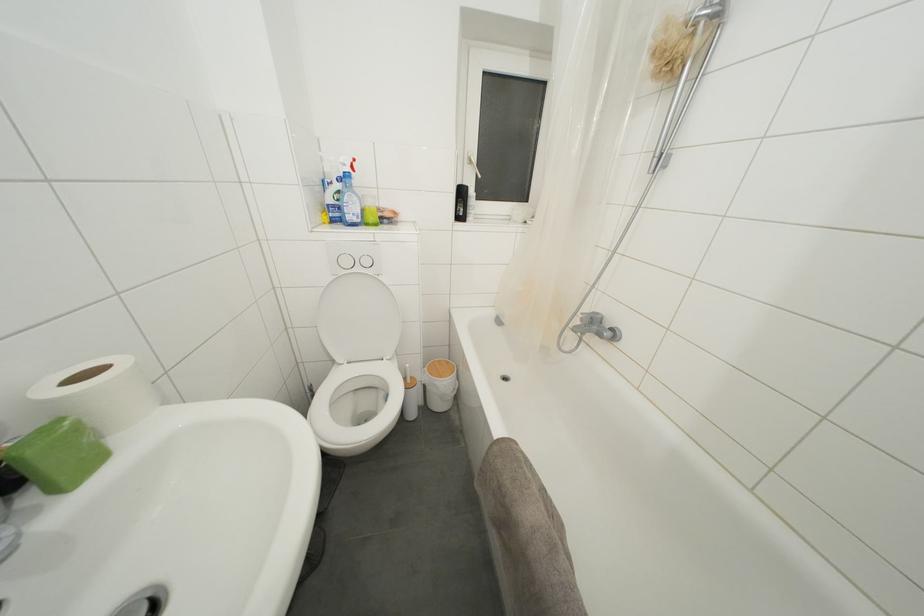
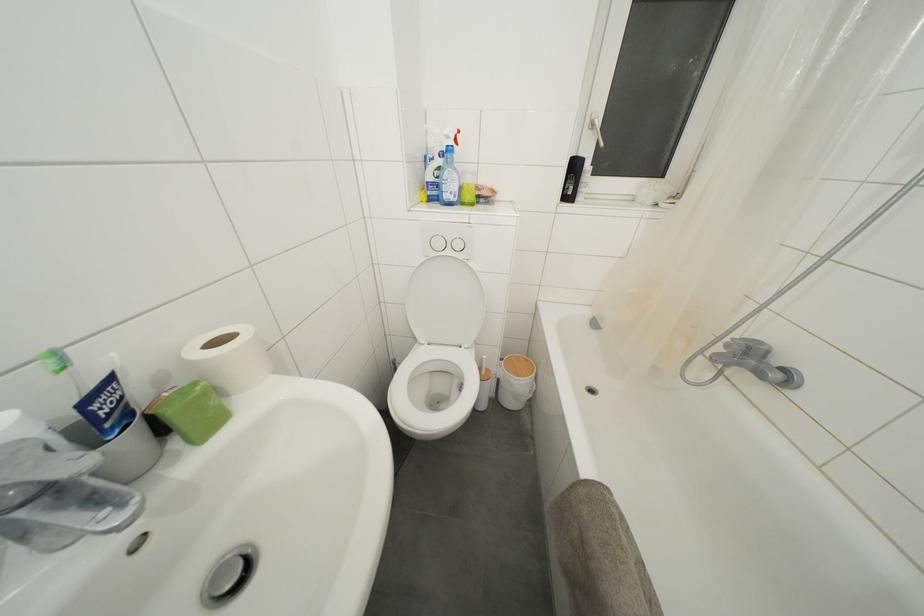
Question: The images are taken continuously from a first-person perspective. In which direction is your viewpoint rotating?

Choices:
 (A) Left
 (B) Right
 (C) Up
 (D) Down

Answer: (A)